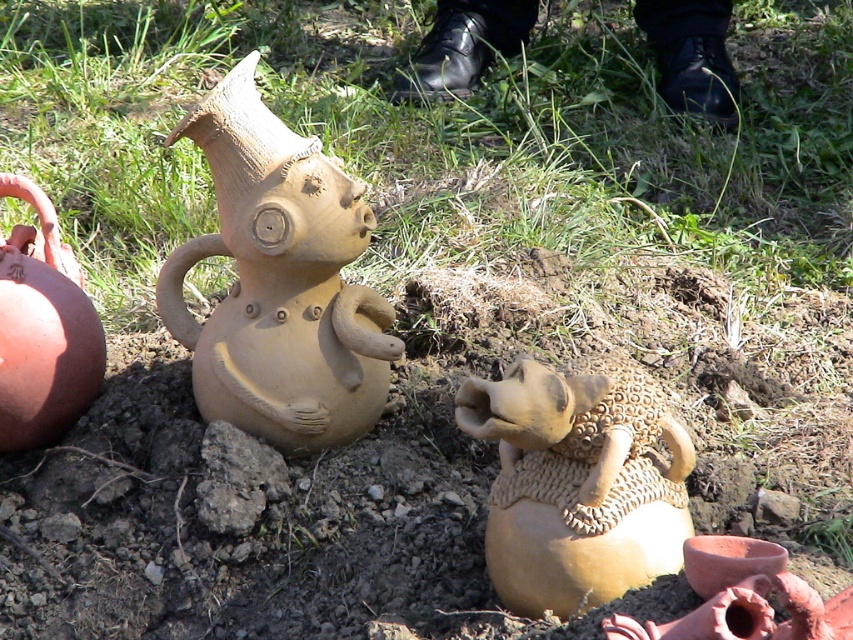
Is matte clay pig at center positioned at the back of matte clay jug at left?

No, matte clay pig at center is closer to the viewer.

Does matte clay pig at center lie in front of matte clay jug at left?

Yes, it is.

You are a GUI agent. You are given a task and a screenshot of the screen. Output one action in this format:
    pyautogui.click(x=<x>, y=<y>)
    Task: Click on the matte clay pig at center
    The width and height of the screenshot is (853, 640).
    Given the screenshot: What is the action you would take?
    pyautogui.click(x=577, y=483)

Between matte clay figure at left and matte clay pig at center, which one appears on the right side from the viewer's perspective?

matte clay pig at center is more to the right.

Who is taller, matte clay figure at left or matte clay pig at center?

matte clay figure at left

The image size is (853, 640). Describe the element at coordinates (279, 282) in the screenshot. I see `matte clay figure at left` at that location.

You are a GUI agent. You are given a task and a screenshot of the screen. Output one action in this format:
    pyautogui.click(x=<x>, y=<y>)
    Task: Click on the matte clay figure at left
    This screenshot has height=640, width=853.
    Given the screenshot: What is the action you would take?
    pyautogui.click(x=279, y=282)

Who is taller, matte clay figure at left or matte clay jug at left?

Standing taller between the two is matte clay figure at left.

The height and width of the screenshot is (640, 853). What do you see at coordinates (279, 282) in the screenshot? I see `matte clay figure at left` at bounding box center [279, 282].

You are a GUI agent. You are given a task and a screenshot of the screen. Output one action in this format:
    pyautogui.click(x=<x>, y=<y>)
    Task: Click on the matte clay figure at left
    This screenshot has height=640, width=853.
    Given the screenshot: What is the action you would take?
    pyautogui.click(x=279, y=282)